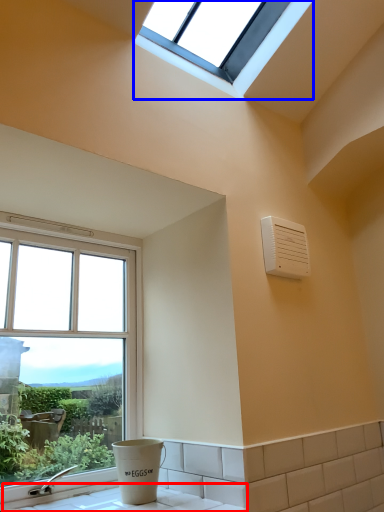
Question: Among these objects, which one is farthest to the camera, counter top (highlighted by a red box) or window (highlighted by a blue box)?

Choices:
 (A) counter top
 (B) window

Answer: (B)